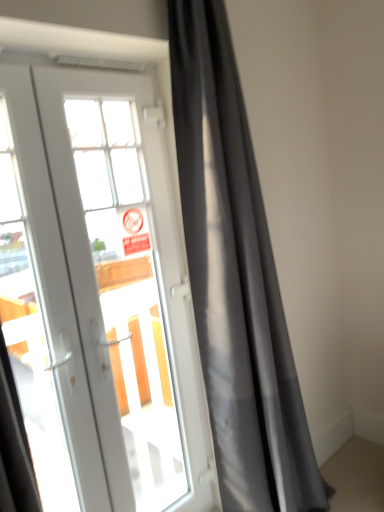
Find the location of `white glass door at center`. white glass door at center is located at coordinates (98, 295).

What do you see at coordinates (98, 295) in the screenshot? I see `white glass door at center` at bounding box center [98, 295].

What are the coordinates of `matte gray curtain at center` in the screenshot? It's located at (236, 279).

Image resolution: width=384 pixels, height=512 pixels. Describe the element at coordinates (236, 279) in the screenshot. I see `matte gray curtain at center` at that location.

Find the location of a particular element. The image size is (384, 512). white glass door at center is located at coordinates (98, 295).

Does white glass door at center appear on the right side of matte gray curtain at center?

No.

Is white glass door at center closer to the viewer compared to matte gray curtain at center?

Yes.

Does point (109, 202) lie behind point (184, 106)?

Yes, it is.

From the image's perspective, who appears lower, white glass door at center or matte gray curtain at center?

From the image's view, white glass door at center is below.

Looking at this image, from a real-world perspective, is white glass door at center on matte gray curtain at center?

→ Actually, white glass door at center is physically below matte gray curtain at center in the real world.

Considering the sizes of white glass door at center and matte gray curtain at center in the image, is white glass door at center wider or thinner than matte gray curtain at center?

Considering their sizes, white glass door at center looks slimmer than matte gray curtain at center.

Between white glass door at center and matte gray curtain at center, which one has less height?

With less height is white glass door at center.

In terms of size, does white glass door at center appear bigger or smaller than matte gray curtain at center?

Considering their sizes, white glass door at center takes up less space than matte gray curtain at center.

Looking at this image, is white glass door at center spatially inside matte gray curtain at center, or outside of it?

white glass door at center lies outside matte gray curtain at center.

Is white glass door at center touching matte gray curtain at center?

No.

In the scene shown: Is white glass door at center oriented away from matte gray curtain at center?

No, white glass door at center is not facing the opposite direction of matte gray curtain at center.

How many degrees apart are the facing directions of white glass door at center and matte gray curtain at center?

The facing directions of white glass door at center and matte gray curtain at center are 0.827 degrees apart.

The height and width of the screenshot is (512, 384). What are the coordinates of `curtain positioned vertically above the white glass door at center (from a real-world perspective)` in the screenshot? It's located at (236, 279).

Considering the relative positions of matte gray curtain at center and white glass door at center in the image provided, is matte gray curtain at center to the right of white glass door at center from the viewer's perspective?

Correct, you'll find matte gray curtain at center to the right of white glass door at center.

Relative to white glass door at center, is matte gray curtain at center in front or behind?

Visually, matte gray curtain at center is located behind white glass door at center.

Which is farther from the camera, (270, 293) or (148, 488)?

The point (148, 488) is farther from the camera.

From the image's perspective, who appears lower, matte gray curtain at center or white glass door at center?

From the image's view, white glass door at center is below.

In the scene shown: From a real-world perspective, which object stands above the other?

matte gray curtain at center.

In terms of width, does matte gray curtain at center look wider or thinner when compared to white glass door at center?

In the image, matte gray curtain at center appears to be wider than white glass door at center.

Who is taller, matte gray curtain at center or white glass door at center?

matte gray curtain at center is taller.

Considering the sizes of matte gray curtain at center and white glass door at center in the image, is matte gray curtain at center bigger or smaller than white glass door at center?

Clearly, matte gray curtain at center is larger in size than white glass door at center.

Choose the correct answer: Is matte gray curtain at center inside white glass door at center or outside it?

matte gray curtain at center is spatially situated outside white glass door at center.

Is matte gray curtain at center far from white glass door at center?

No, matte gray curtain at center is not far from white glass door at center.

Could you tell me if matte gray curtain at center is facing white glass door at center?

No, matte gray curtain at center does not turn towards white glass door at center.

This screenshot has height=512, width=384. In order to click on curtain above the white glass door at center (from the image's perspective) in this screenshot , I will do `click(236, 279)`.

Image resolution: width=384 pixels, height=512 pixels. Identify the location of curtain behind the white glass door at center. [x=236, y=279].

Locate an element on the screen. The width and height of the screenshot is (384, 512). curtain located on the right of white glass door at center is located at coordinates (236, 279).